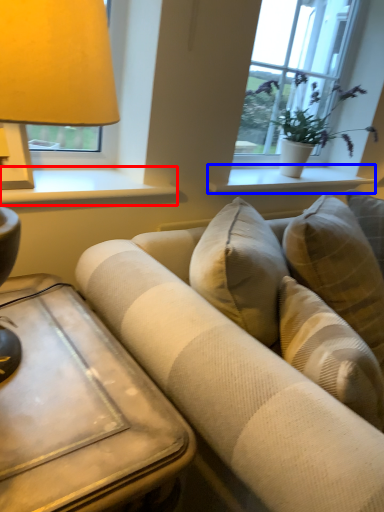
Question: Which point is further to the camera, window sill (highlighted by a red box) or window sill (highlighted by a blue box)?

Choices:
 (A) window sill
 (B) window sill

Answer: (B)